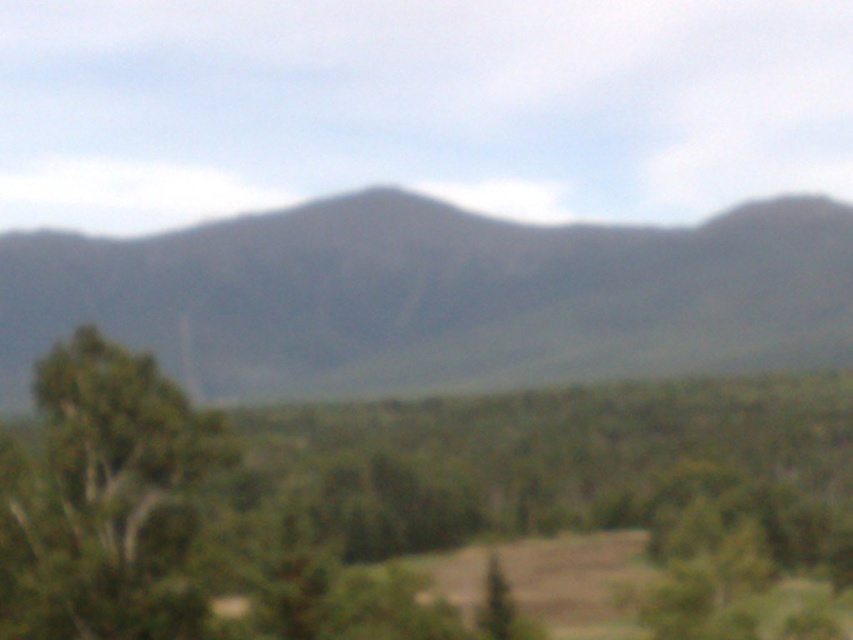
You are a hiker trying to navigate through the dense greenery in the foreground. You see the green leafy tree at center and the green leafy tree at left. Which tree would you choose to walk around to find a clearer path, and why?

The green leafy tree at center has a larger size compared to the green leafy tree at left. Therefore, the green leafy tree at left is smaller and might have a clearer path around it.

You are a hiker who wants to take a photo of the gray matte mountain at center and the green leafy tree at left. From your current position, which object is higher in the frame?

The gray matte mountain at center is above the green leafy tree at left in the frame.